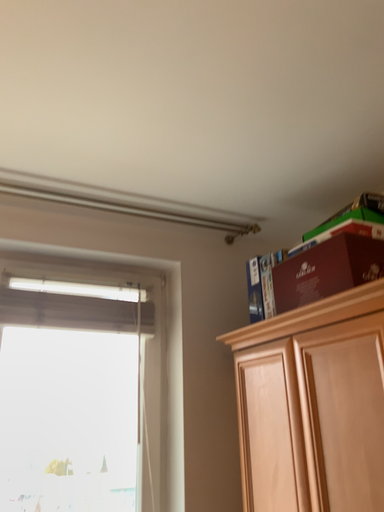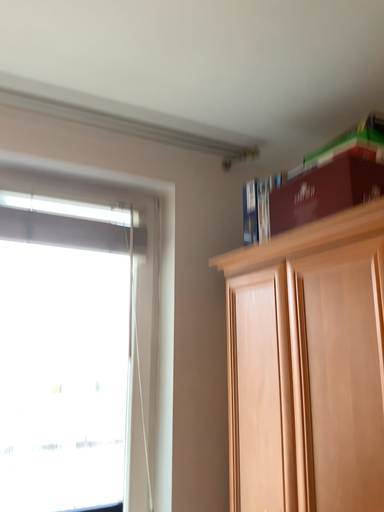
Question: How did the camera likely rotate when shooting the video?

Choices:
 (A) rotated upward
 (B) rotated downward

Answer: (B)